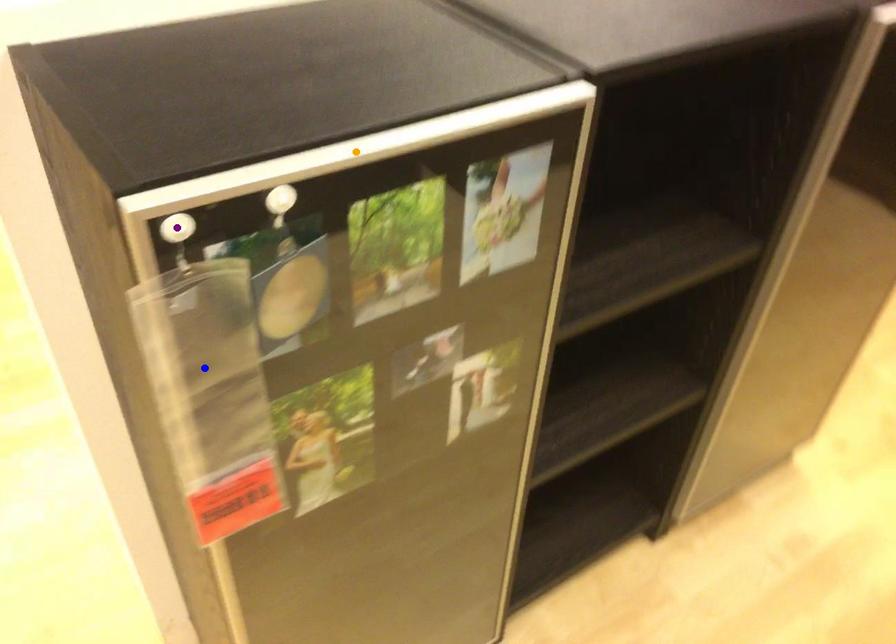
Order these from nearest to farthest:
1. blue point
2. orange point
3. purple point

purple point < orange point < blue point